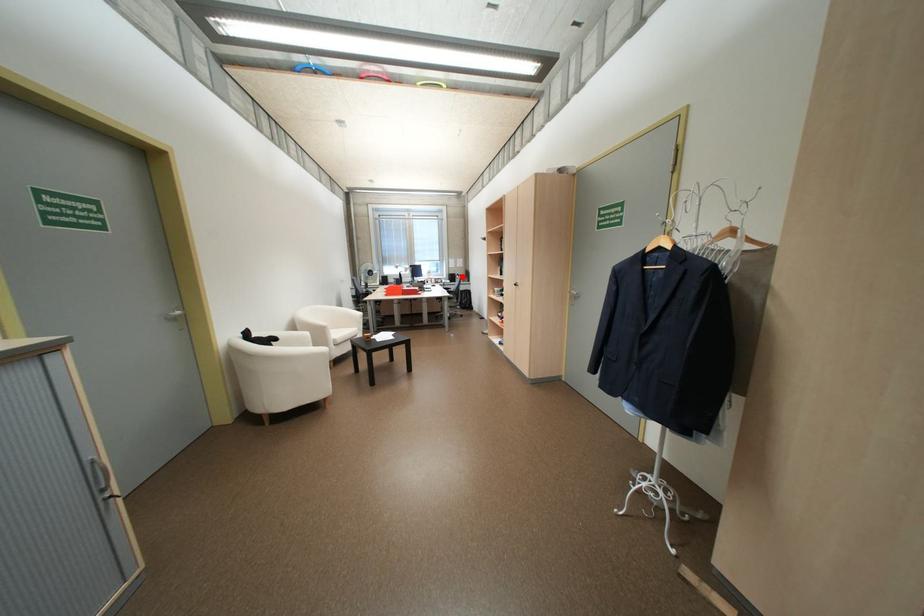
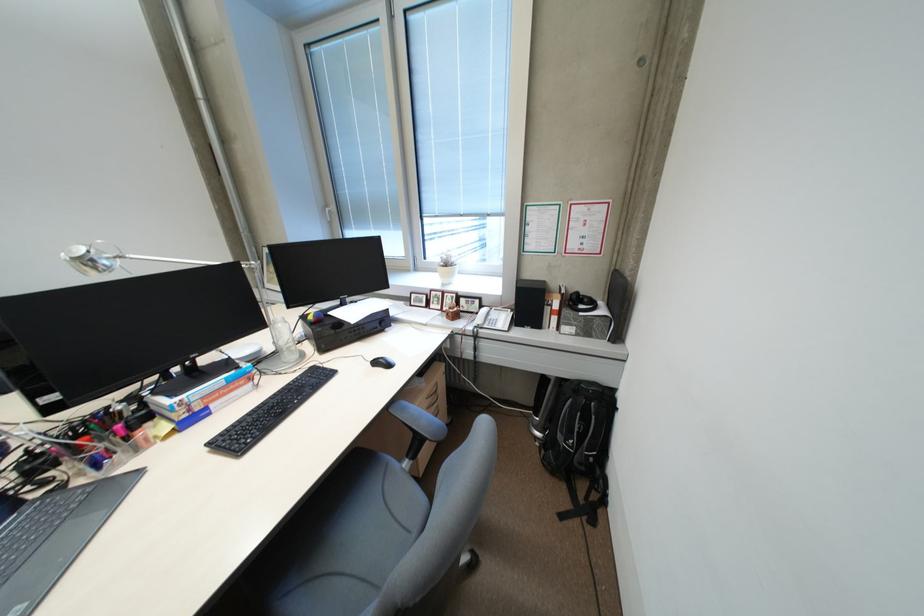
Question: I am providing you with two images of the same scene from different viewpoints. Image1 has a red point marked. In image2, the corresponding 3D location appears at what relative position? Reply with the corresponding letter.

Choices:
 (A) Closer
 (B) Farther

Answer: (B)